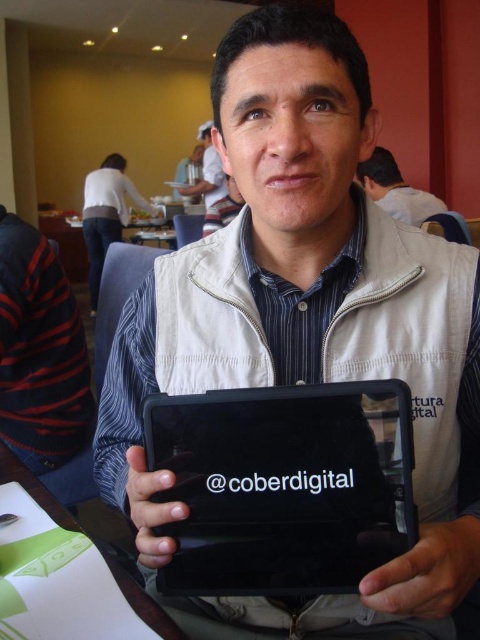
Between black matte tablet at center and matte white shirt at upper center, which one has more height?

Standing taller between the two is matte white shirt at upper center.

Which is in front, point (365, 465) or point (210, 195)?

Point (365, 465) is more forward.

Describe the element at coordinates (284, 484) in the screenshot. I see `black matte tablet at center` at that location.

The image size is (480, 640). Find the location of `black matte tablet at center`. black matte tablet at center is located at coordinates (284, 484).

Who is taller, black matte sweater at left or matte white tablet at center?

black matte sweater at left is taller.

Does black matte sweater at left appear on the left side of matte white tablet at center?

Indeed, black matte sweater at left is positioned on the left side of matte white tablet at center.

Does point (9, 262) come closer to viewer compared to point (206, 227)?

Yes, it is in front of point (206, 227).

You are a GUI agent. You are given a task and a screenshot of the screen. Output one action in this format:
    pyautogui.click(x=<x>, y=<y>)
    Task: Click on the black matte sweater at left
    The width and height of the screenshot is (480, 640).
    Given the screenshot: What is the action you would take?
    pyautogui.click(x=43, y=364)

Is green plastic table at lower left positioned in front of matte white shirt at upper center?

Yes, green plastic table at lower left is closer to the viewer.

The width and height of the screenshot is (480, 640). What do you see at coordinates (143, 602) in the screenshot?
I see `green plastic table at lower left` at bounding box center [143, 602].

Locate an element on the screen. green plastic table at lower left is located at coordinates (143, 602).